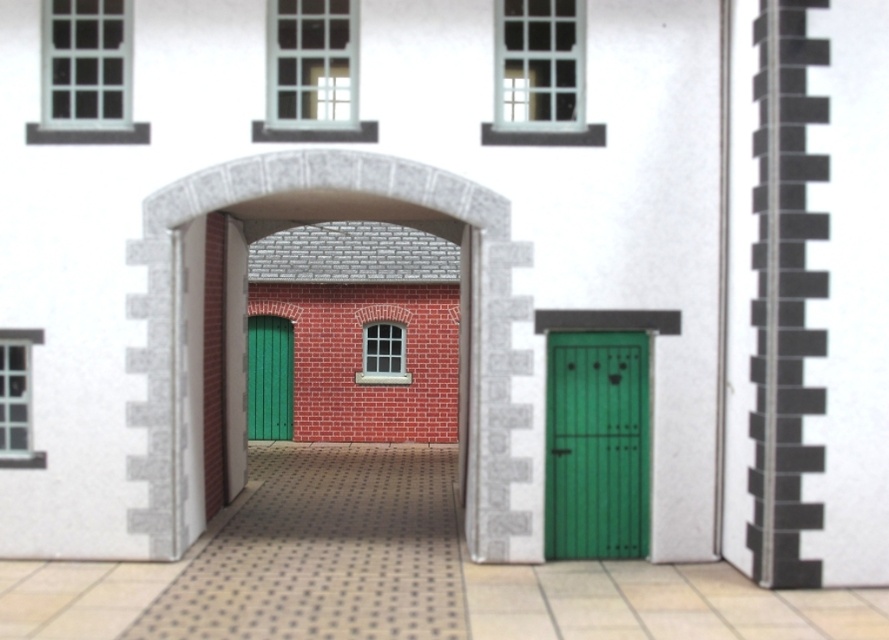
Question: Estimate the real-world distances between objects in this image. Which object is farther from the green matte door at right?

Choices:
 (A) green wooden door at center
 (B) brick textured archway at center

Answer: (A)

Question: Is brick textured archway at center smaller than green wooden door at center?

Choices:
 (A) yes
 (B) no

Answer: (B)

Question: Is brick textured archway at center above green matte door at right?

Choices:
 (A) yes
 (B) no

Answer: (A)

Question: Which point appears farthest from the camera in this image?

Choices:
 (A) (157, 262)
 (B) (265, 413)
 (C) (557, 525)

Answer: (B)

Question: Does brick textured archway at center appear under green wooden door at center?

Choices:
 (A) no
 (B) yes

Answer: (A)

Question: Which is farther from the green matte door at right?

Choices:
 (A) green wooden door at center
 (B) brick textured archway at center

Answer: (A)